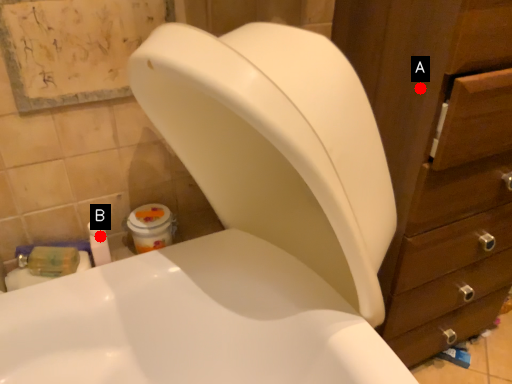
Question: Two points are circled on the image, labeled by A and B beside each circle. Which point is closer to the camera?

Choices:
 (A) A is closer
 (B) B is closer

Answer: (A)